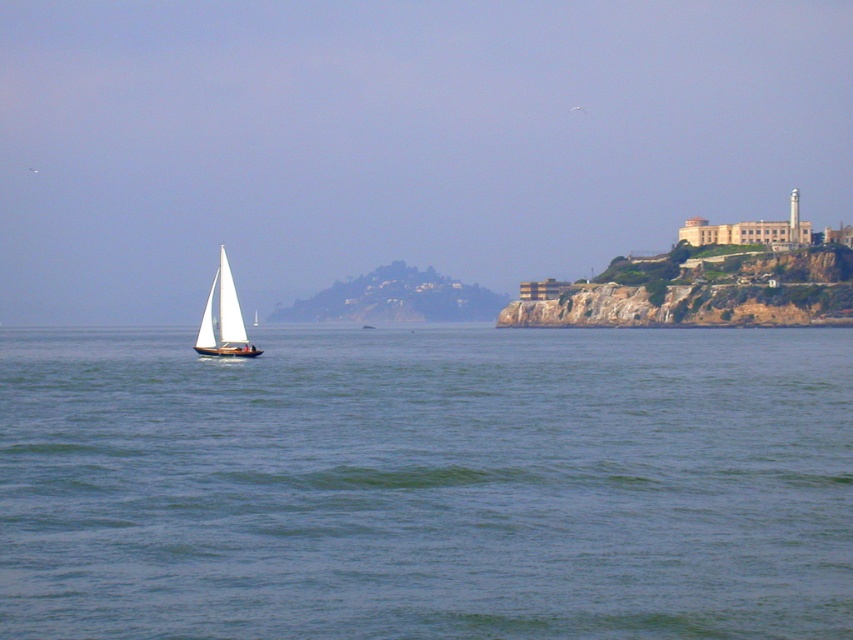
Question: Does green water at center lie behind white matte sailboat at left?

Choices:
 (A) no
 (B) yes

Answer: (A)

Question: Is green water at center smaller than white matte sailboat at left?

Choices:
 (A) no
 (B) yes

Answer: (A)

Question: Can you confirm if green water at center is positioned to the right of white matte sailboat at left?

Choices:
 (A) yes
 (B) no

Answer: (A)

Question: Which point is closer to the camera?

Choices:
 (A) (15, 540)
 (B) (215, 355)

Answer: (A)

Question: Among these objects, which one is nearest to the camera?

Choices:
 (A) green water at center
 (B) white matte sailboat at left

Answer: (A)